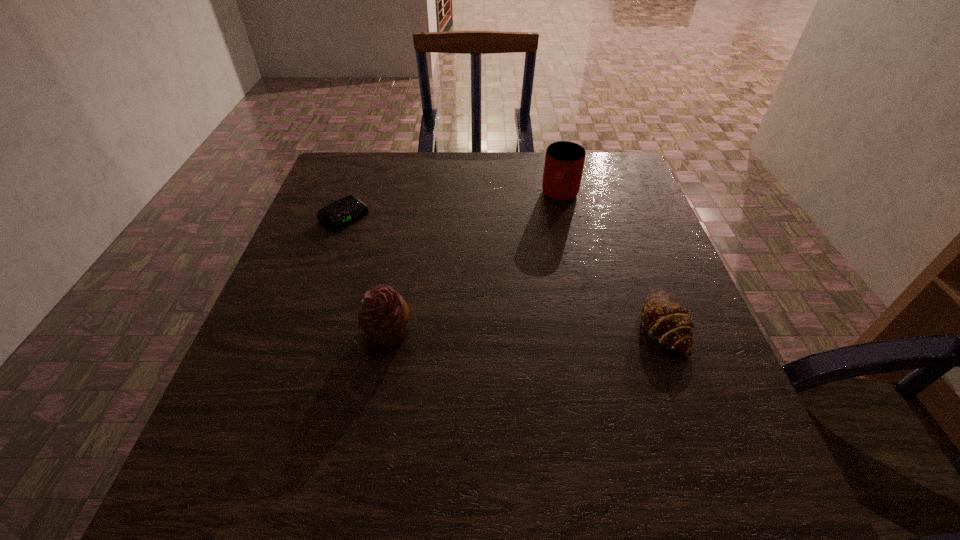
Where is `free space at the right edge`? free space at the right edge is located at coordinates (684, 356).

Locate an element on the screen. free space at the far left corner is located at coordinates (338, 159).

In the image, there is a desktop. What are the coordinates of `free space at the far right corner` in the screenshot? It's located at (593, 180).

The image size is (960, 540). I want to click on vacant space at the near right corner, so (744, 419).

At what (x,y) coordinates should I click in order to perform the action: click on vacant space that is in between the second object from left to right and the shortest object. Please return your answer as a coordinate pair (x, y). This screenshot has height=540, width=960. Looking at the image, I should click on (366, 273).

Where is `free space between the cupcake and the leftmost object`? This screenshot has width=960, height=540. free space between the cupcake and the leftmost object is located at coordinates (366, 273).

You are a GUI agent. You are given a task and a screenshot of the screen. Output one action in this format:
    pyautogui.click(x=<x>, y=<y>)
    Task: Click on the vacant region between the cupcake and the crescent roll
    The height and width of the screenshot is (540, 960).
    Given the screenshot: What is the action you would take?
    pyautogui.click(x=525, y=328)

This screenshot has height=540, width=960. Find the location of `vacant space in between the cupcake and the crescent roll`. vacant space in between the cupcake and the crescent roll is located at coordinates (525, 328).

The width and height of the screenshot is (960, 540). In order to click on free space between the third object from left to right and the alarm clock in this screenshot , I will do `click(452, 206)`.

This screenshot has height=540, width=960. I want to click on vacant area that lies between the cupcake and the second shortest object, so click(x=525, y=328).